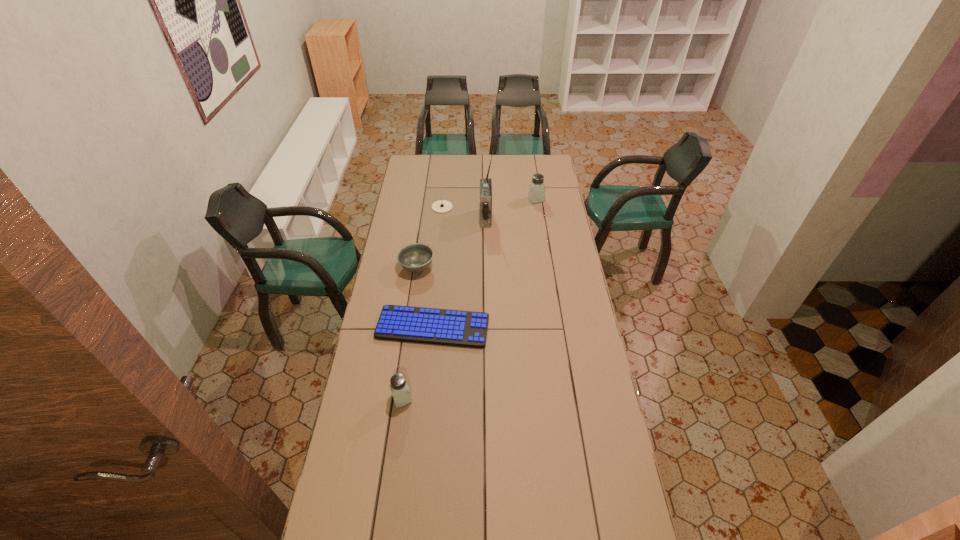
Locate an element on the screen. This screenshot has width=960, height=540. computer keyboard that is at the left edge is located at coordinates (447, 327).

This screenshot has height=540, width=960. What are the coordinates of `object present at the right edge` in the screenshot? It's located at (536, 192).

Locate an element on the screen. free spot at the far edge of the desktop is located at coordinates coord(469,168).

In the image, there is a desktop. Where is `free space at the near edge`? The image size is (960, 540). free space at the near edge is located at coordinates (429, 503).

Where is `free space at the left edge of the desktop`? This screenshot has width=960, height=540. free space at the left edge of the desktop is located at coordinates click(x=385, y=397).

Locate an element on the screen. vacant region at the right edge of the desktop is located at coordinates (545, 253).

Where is `vacant region at the far right corner of the desktop`? The width and height of the screenshot is (960, 540). vacant region at the far right corner of the desktop is located at coordinates (546, 167).

The height and width of the screenshot is (540, 960). Identify the location of unoccupied area between the fourth farthest object and the second nearest object. (424, 297).

Where is `vacant space that's between the farther saltshaker and the computer keyboard`? The height and width of the screenshot is (540, 960). vacant space that's between the farther saltshaker and the computer keyboard is located at coordinates (484, 264).

Where is `empty location between the second shortest object and the radio receiver`? The height and width of the screenshot is (540, 960). empty location between the second shortest object and the radio receiver is located at coordinates click(x=464, y=213).